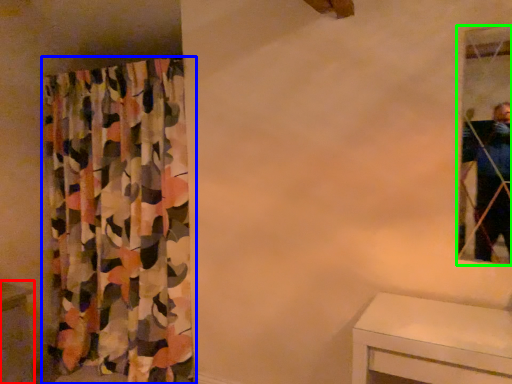
Question: Which is nearer to the vanity (highlighted by a red box)? curtain (highlighted by a blue box) or mirror (highlighted by a green box).

Choices:
 (A) curtain
 (B) mirror

Answer: (A)